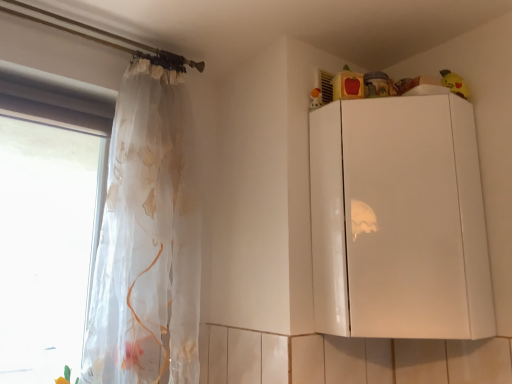
Question: Does white glossy cabinet at upper right have a greater width compared to transparent fabric at left?

Choices:
 (A) yes
 (B) no

Answer: (A)

Question: From the image's perspective, is white glossy cabinet at upper right on top of transparent fabric at left?

Choices:
 (A) no
 (B) yes

Answer: (B)

Question: Considering the relative positions of white glossy cabinet at upper right and transparent fabric at left in the image provided, is white glossy cabinet at upper right to the right of transparent fabric at left from the viewer's perspective?

Choices:
 (A) no
 (B) yes

Answer: (B)

Question: From the image's perspective, is white glossy cabinet at upper right beneath transparent fabric at left?

Choices:
 (A) yes
 (B) no

Answer: (B)

Question: Does white glossy cabinet at upper right have a lesser height compared to transparent fabric at left?

Choices:
 (A) yes
 (B) no

Answer: (A)

Question: Relative to matte orange toy at upper right, which appears as the first toy when viewed from the left, is white glossy cabinet at upper right in front or behind?

Choices:
 (A) front
 (B) behind

Answer: (A)

Question: Is white glossy cabinet at upper right taller or shorter than matte orange toy at upper right, the second toy viewed from the right?

Choices:
 (A) tall
 (B) short

Answer: (A)

Question: In terms of width, does white glossy cabinet at upper right look wider or thinner when compared to matte orange toy at upper right, the second toy viewed from the right?

Choices:
 (A) wide
 (B) thin

Answer: (A)

Question: Is white glossy cabinet at upper right spatially inside matte orange toy at upper right, the second toy viewed from the right, or outside of it?

Choices:
 (A) outside
 (B) inside

Answer: (A)

Question: In the image, is yellow plush toy at upper right, positioned as the 2th toy in left-to-right order, positioned in front of or behind white glossy cabinet at upper right?

Choices:
 (A) front
 (B) behind

Answer: (B)

Question: Is yellow plush toy at upper right, positioned as the 2th toy in left-to-right order, situated inside white glossy cabinet at upper right or outside?

Choices:
 (A) outside
 (B) inside

Answer: (A)

Question: Based on their sizes in the image, would you say yellow plush toy at upper right, positioned as the 2th toy in left-to-right order, is bigger or smaller than white glossy cabinet at upper right?

Choices:
 (A) big
 (B) small

Answer: (B)

Question: From their relative heights in the image, would you say yellow plush toy at upper right, which appears as the 1th toy when viewed from the right, is taller or shorter than white glossy cabinet at upper right?

Choices:
 (A) tall
 (B) short

Answer: (B)

Question: Which is correct: matte orange toy at upper right, which appears as the first toy when viewed from the left, is inside white glossy cabinet at upper right, or outside of it?

Choices:
 (A) inside
 (B) outside

Answer: (B)

Question: Looking at the image, does matte orange toy at upper right, the second toy viewed from the right, seem bigger or smaller compared to white glossy cabinet at upper right?

Choices:
 (A) small
 (B) big

Answer: (A)